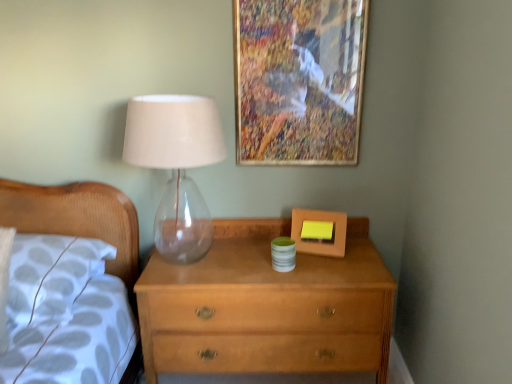
Question: Relative to white fabric pillow at left, is transparent glass table lamp at left in front or behind?

Choices:
 (A) front
 (B) behind

Answer: (A)

Question: Is transparent glass table lamp at left wider or thinner than white fabric pillow at left?

Choices:
 (A) thin
 (B) wide

Answer: (A)

Question: Based on their relative distances, which object is farther from the wooden picture frame at upper center, which appears as the 2th picture frame when ordered from the bottom?

Choices:
 (A) white fabric pillow at left
 (B) light brown wood chest of drawers at center
 (C) transparent glass table lamp at left
 (D) matte wooden picture frame at center, the 2th picture frame in the top-to-bottom sequence

Answer: (A)

Question: Which is farther from the transparent glass table lamp at left?

Choices:
 (A) matte wooden picture frame at center, which is counted as the first picture frame, starting from the bottom
 (B) white fabric pillow at left
 (C) light brown wood chest of drawers at center
 (D) wooden picture frame at upper center, which appears as the 2th picture frame when ordered from the bottom

Answer: (C)